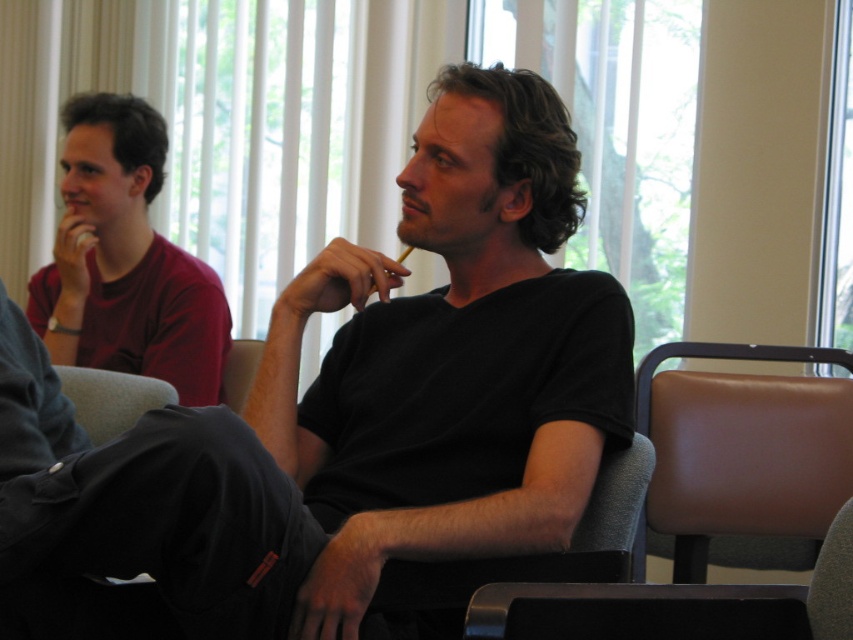
Question: Can you confirm if black matte shirt at center is bigger than brown leather chair at right?

Choices:
 (A) yes
 (B) no

Answer: (A)

Question: Is matte red shirt at left bigger than gray fabric chair at lower right?

Choices:
 (A) yes
 (B) no

Answer: (A)

Question: Does black matte shirt at center have a larger size compared to gray fabric chair at lower right?

Choices:
 (A) no
 (B) yes

Answer: (B)

Question: Among these objects, which one is nearest to the camera?

Choices:
 (A) brown leather chair at right
 (B) gray fabric chair at lower left
 (C) gray fabric chair at lower right

Answer: (C)

Question: Estimate the real-world distances between objects in this image. Which object is farther from the brown leather chair at right?

Choices:
 (A) matte red shirt at left
 (B) matte gray chair at center
 (C) gray fabric chair at lower right

Answer: (A)

Question: Which point is closer to the camera taking this photo?

Choices:
 (A) tap(764, 508)
 (B) tap(231, 371)
 (C) tap(717, 608)
 (D) tap(161, 333)

Answer: (C)